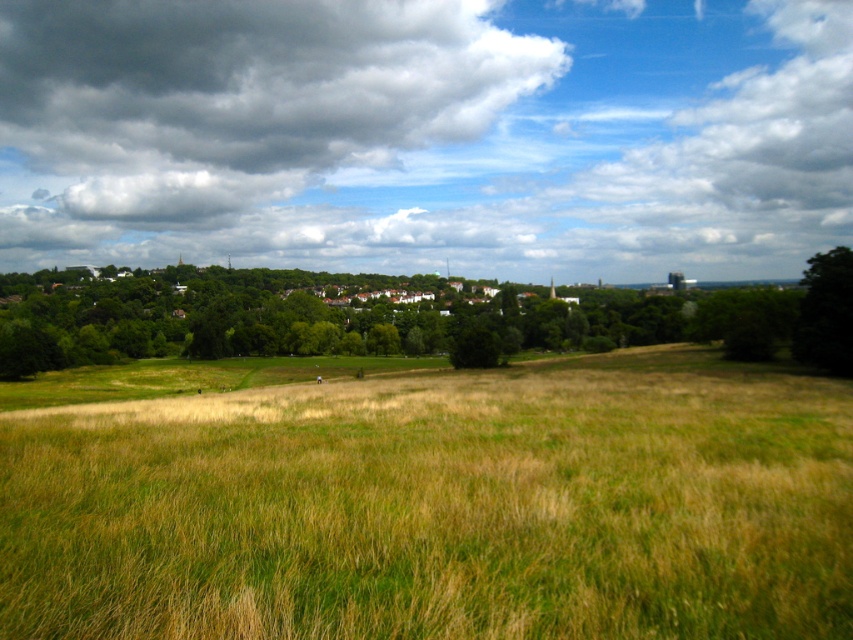
Question: Which object is the closest to the dark gray fluffy cloud at upper center?

Choices:
 (A) green leafy tree at right
 (B) green leafy tree at upper center

Answer: (B)

Question: Which point appears closest to the camera in this image?

Choices:
 (A) (804, 276)
 (B) (495, 529)
 (C) (207, 316)

Answer: (B)

Question: Can you confirm if green grassy field at center is thinner than green leafy tree at upper center?

Choices:
 (A) yes
 (B) no

Answer: (A)

Question: Does green leafy tree at upper center have a larger size compared to green leafy tree at right?

Choices:
 (A) yes
 (B) no

Answer: (A)

Question: Which of the following is the closest to the observer?

Choices:
 (A) green leafy tree at upper center
 (B) dark gray fluffy cloud at upper center
 (C) green grassy field at center

Answer: (C)

Question: Observing the image, what is the correct spatial positioning of dark gray fluffy cloud at upper center in reference to green leafy tree at upper center?

Choices:
 (A) right
 (B) left

Answer: (B)